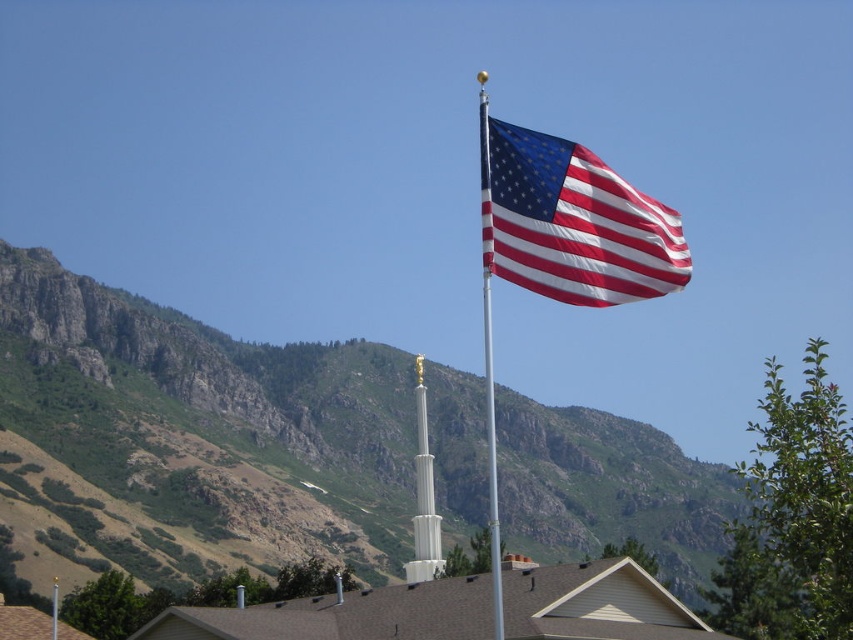
You are standing in front of the scene and want to take a photo of the white glossy column at center. To avoid the silver metallic flag pole at upper center appearing in your photo, should you move to the left or the right?

The silver metallic flag pole at upper center is to the right of the white glossy column at center. To avoid the flag pole in your photo, you should move to the right side of the column.

You are a photographer planning to take a closeup shot of the matte fabric flag at upper center. Since the silver metallic flag pole at upper center might block the view, can you confirm if the flag is positioned above the pole?

A: The matte fabric flag at upper center is located above the silver metallic flag pole at upper center, so it will not block the view when taking the closeup shot.

You are an architect designing a new public plaza and want to ensure that the silver metallic flag pole at upper center and the white glossy column at center are proportionally balanced. Given their widths, which object should be placed further back to maintain visual harmony?

The silver metallic flag pole at upper center is wider than the white glossy column at center. To maintain visual harmony, the wider silver metallic flag pole at upper center should be placed further back so that its larger size doesn